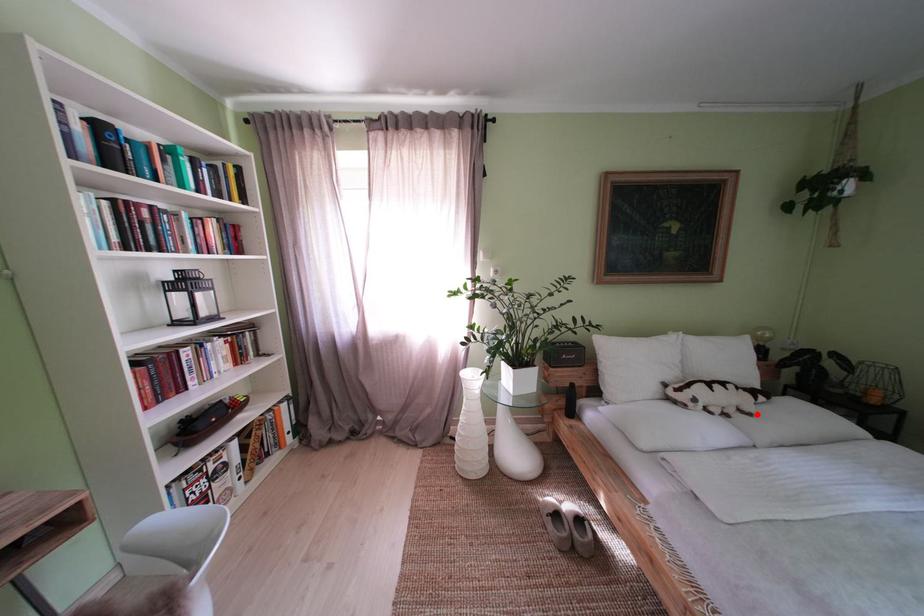
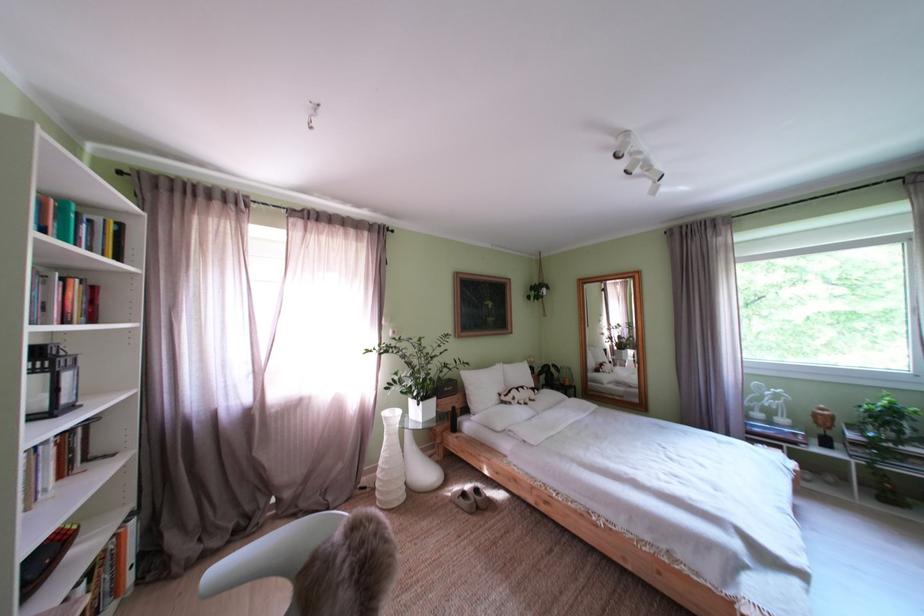
Locate, in the second image, the point that corresponds to the highlighted location in the first image.

(543, 403)